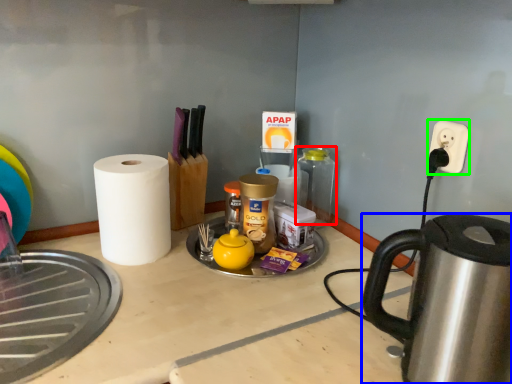
Question: Considering the real-world distances, which object is closest to bottle (highlighted by a red box)? kettle (highlighted by a blue box) or electric outlet (highlighted by a green box).

Choices:
 (A) kettle
 (B) electric outlet

Answer: (B)